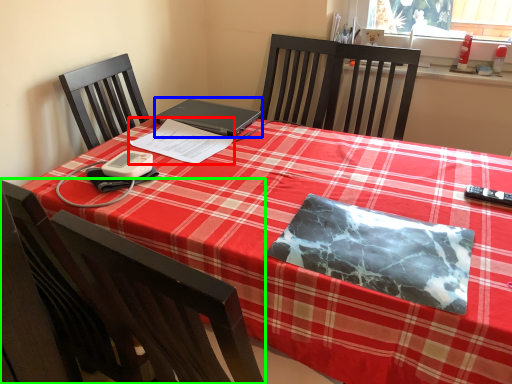
Question: Which object is positioned closest to notebook (highlighted by a red box)? Select from laptop (highlighted by a blue box) and chair (highlighted by a green box).

Choices:
 (A) laptop
 (B) chair

Answer: (A)